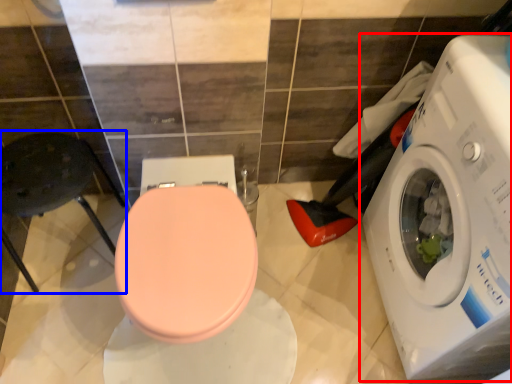
Question: Which of the following is the closest to the observer, washing machine (highlighted by a red box) or chair (highlighted by a blue box)?

Choices:
 (A) washing machine
 (B) chair

Answer: (A)